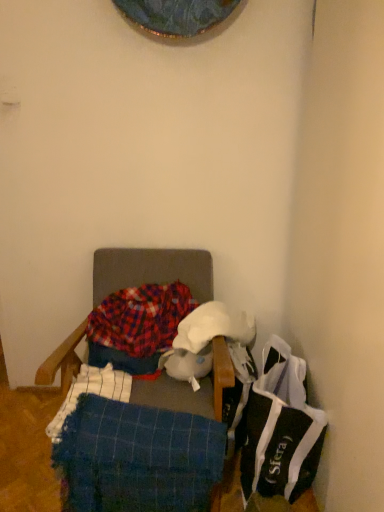
Question: From the image's perspective, is plaid fabric chair at center under black fabric bag at lower right?

Choices:
 (A) no
 (B) yes

Answer: (A)

Question: Is plaid fabric chair at center at the right side of black fabric bag at lower right?

Choices:
 (A) yes
 (B) no

Answer: (B)

Question: Can you confirm if plaid fabric chair at center is positioned to the left of black fabric bag at lower right?

Choices:
 (A) yes
 (B) no

Answer: (A)

Question: Considering the relative sizes of plaid fabric chair at center and black fabric bag at lower right in the image provided, is plaid fabric chair at center wider than black fabric bag at lower right?

Choices:
 (A) no
 (B) yes

Answer: (B)

Question: Is plaid fabric chair at center placed right next to black fabric bag at lower right?

Choices:
 (A) no
 (B) yes

Answer: (A)

Question: Can you confirm if plaid fabric chair at center is shorter than black fabric bag at lower right?

Choices:
 (A) yes
 (B) no

Answer: (B)

Question: Can you see black fabric bag at lower right touching plaid fabric chair at center?

Choices:
 (A) yes
 (B) no

Answer: (B)

Question: From the image's perspective, does black fabric bag at lower right appear lower than plaid fabric chair at center?

Choices:
 (A) no
 (B) yes

Answer: (B)

Question: Does black fabric bag at lower right have a lesser height compared to plaid fabric chair at center?

Choices:
 (A) no
 (B) yes

Answer: (B)

Question: Does black fabric bag at lower right come behind plaid fabric chair at center?

Choices:
 (A) yes
 (B) no

Answer: (A)

Question: Does black fabric bag at lower right have a greater width compared to plaid fabric chair at center?

Choices:
 (A) yes
 (B) no

Answer: (B)

Question: Is black fabric bag at lower right thinner than plaid fabric chair at center?

Choices:
 (A) no
 (B) yes

Answer: (B)

Question: Would you say blue woven blanket at lower left, positioned as the 2th blanket in back-to-front order, contains black fabric bag at lower right?

Choices:
 (A) yes
 (B) no

Answer: (B)